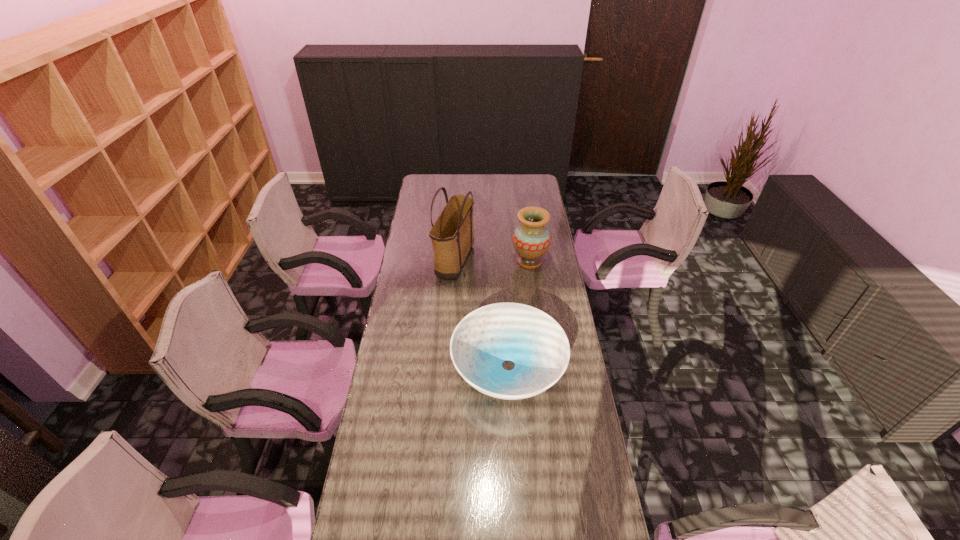
What are the coordinates of `free region at the far edge` in the screenshot? It's located at (460, 182).

Identify the location of vacant region at the left edge of the desktop. This screenshot has width=960, height=540. (428, 213).

Image resolution: width=960 pixels, height=540 pixels. In the image, there is a desktop. Find the location of `vacant space at the right edge`. vacant space at the right edge is located at coordinates (597, 514).

Image resolution: width=960 pixels, height=540 pixels. In the image, there is a desktop. In order to click on free space at the far right corner in this screenshot , I will do `click(522, 176)`.

Identify the location of unoccupied area between the tallest object and the second shortest object. (x=492, y=262).

The height and width of the screenshot is (540, 960). In order to click on object that can be found as the second closest to the tote bag in this screenshot , I will do `click(537, 345)`.

I want to click on object identified as the second closest to the tote bag, so click(537, 345).

At what (x,y) coordinates should I click in order to perform the action: click on free space that satisfies the following two spatial constraints: 1. on the back side of the shortest object; 2. on the left side of the second tallest object. Please return your answer as a coordinate pair (x, y). The image size is (960, 540). Looking at the image, I should click on (502, 261).